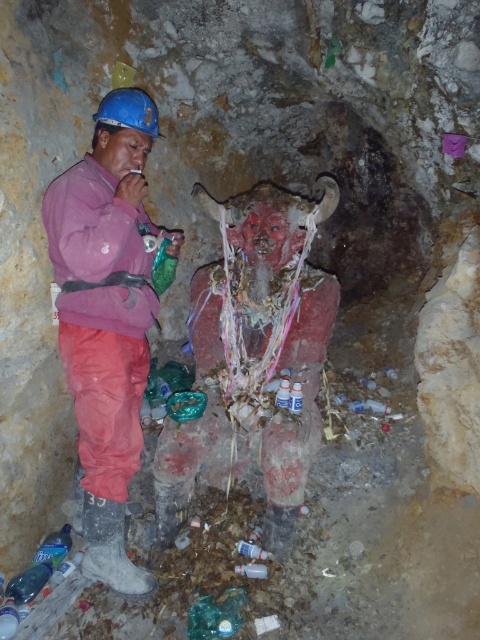
Question: Does matte pink jacket at left have a smaller size compared to matte red statue at center?

Choices:
 (A) yes
 (B) no

Answer: (B)

Question: Is matte pink jacket at left bigger than matte red statue at center?

Choices:
 (A) yes
 (B) no

Answer: (A)

Question: Which point is farther to the camera?

Choices:
 (A) matte red statue at center
 (B) matte pink jacket at left

Answer: (A)

Question: Does matte pink jacket at left appear on the left side of matte red statue at center?

Choices:
 (A) yes
 (B) no

Answer: (A)